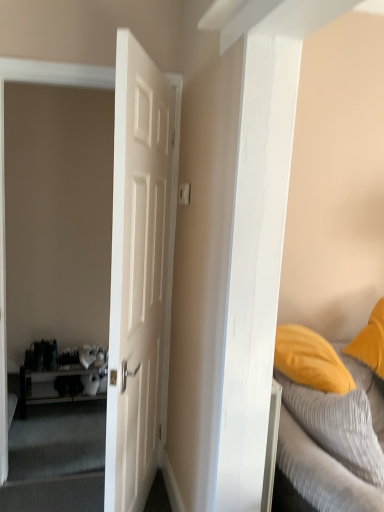
Question: From a real-world perspective, is textured gray bed at right over white matte door at center?

Choices:
 (A) no
 (B) yes

Answer: (A)

Question: Can you confirm if textured gray bed at right is bigger than white matte door at center?

Choices:
 (A) no
 (B) yes

Answer: (A)

Question: Is there a large distance between textured gray bed at right and white matte door at center?

Choices:
 (A) yes
 (B) no

Answer: (B)

Question: Considering the relative sizes of textured gray bed at right and white matte door at center in the image provided, is textured gray bed at right smaller than white matte door at center?

Choices:
 (A) yes
 (B) no

Answer: (A)

Question: Does textured gray bed at right appear on the left side of white matte door at center?

Choices:
 (A) no
 (B) yes

Answer: (A)

Question: Visually, is textured gray bed at right positioned to the left or to the right of white matte door at center?

Choices:
 (A) left
 (B) right

Answer: (B)

Question: Considering their positions, is textured gray bed at right located in front of or behind white matte door at center?

Choices:
 (A) behind
 (B) front

Answer: (A)

Question: Is point (284, 358) positioned closer to the camera than point (152, 291)?

Choices:
 (A) closer
 (B) farther

Answer: (B)

Question: In terms of size, does textured gray bed at right appear bigger or smaller than white matte door at center?

Choices:
 (A) small
 (B) big

Answer: (A)

Question: Considering the positions of point (162, 89) and point (74, 368), is point (162, 89) closer or farther from the camera than point (74, 368)?

Choices:
 (A) farther
 (B) closer

Answer: (B)

Question: Is white matte door at center wider or thinner than wooden shelf at left?

Choices:
 (A) thin
 (B) wide

Answer: (A)

Question: From a real-world perspective, relative to wooden shelf at left, is white matte door at center vertically above or below?

Choices:
 (A) above
 (B) below

Answer: (A)

Question: From their relative heights in the image, would you say white matte door at center is taller or shorter than wooden shelf at left?

Choices:
 (A) short
 (B) tall

Answer: (B)

Question: Considering the positions of textured gray bed at right and wooden shelf at left in the image, is textured gray bed at right bigger or smaller than wooden shelf at left?

Choices:
 (A) big
 (B) small

Answer: (A)

Question: Is textured gray bed at right spatially inside wooden shelf at left, or outside of it?

Choices:
 (A) inside
 (B) outside

Answer: (B)